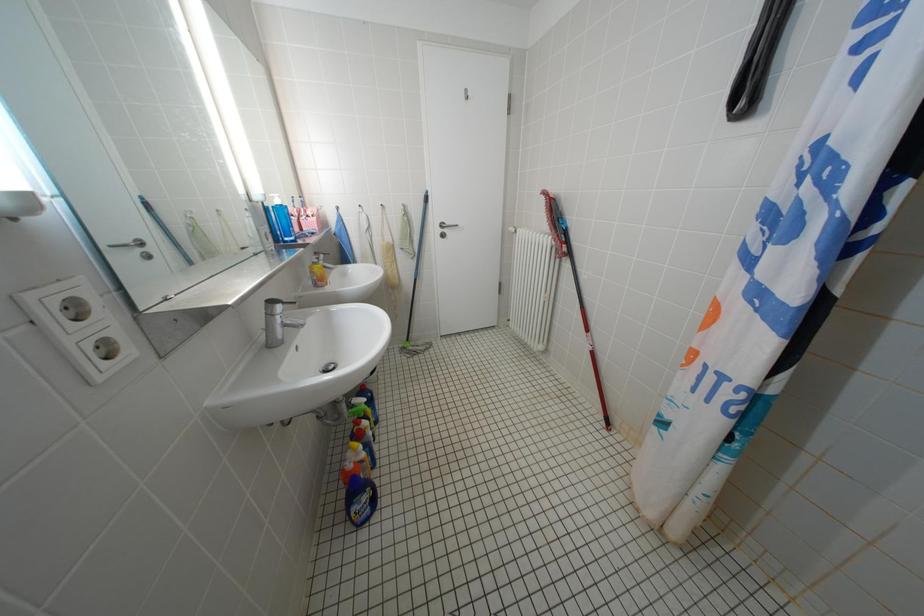
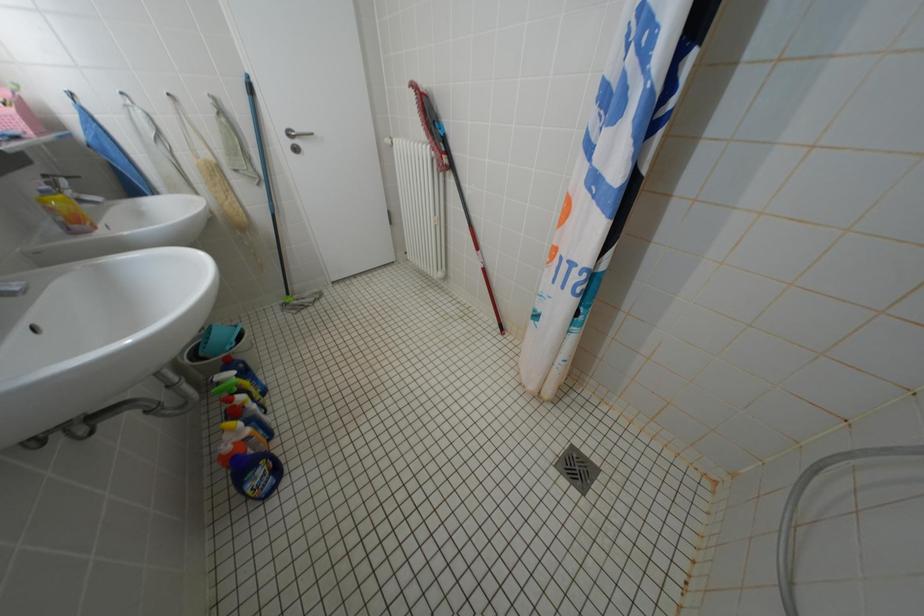
Which direction would the cameraman need to move to produce the second image?

The cameraman walked toward right, forward.